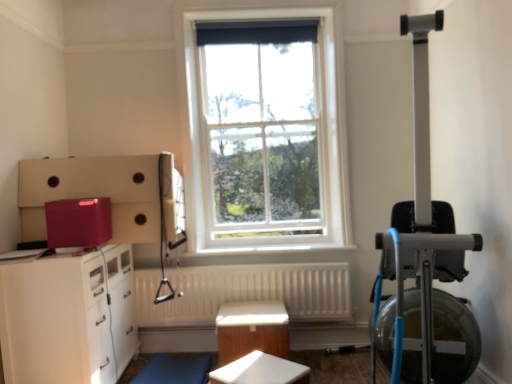
Question: In the image, is white glossy cabinet at lower left on the left side or the right side of white textured radiator at center?

Choices:
 (A) left
 (B) right

Answer: (A)

Question: Is white glossy cabinet at lower left situated inside white textured radiator at center or outside?

Choices:
 (A) outside
 (B) inside

Answer: (A)

Question: Estimate the real-world distances between objects in this image. Which object is farther from the white matte table at center, which is counted as the 2th table, starting from the back?

Choices:
 (A) wooden table at center, arranged as the 1th table when viewed from the back
 (B) white textured radiator at center
 (C) white glossy cabinet at lower left
 (D) white glass window at center

Answer: (D)

Question: Which object is the farthest from the white glossy cabinet at lower left?

Choices:
 (A) white matte table at center, which is counted as the 2th table, starting from the back
 (B) wooden table at center, arranged as the 1th table when viewed from the back
 (C) white textured radiator at center
 (D) white glass window at center

Answer: (D)